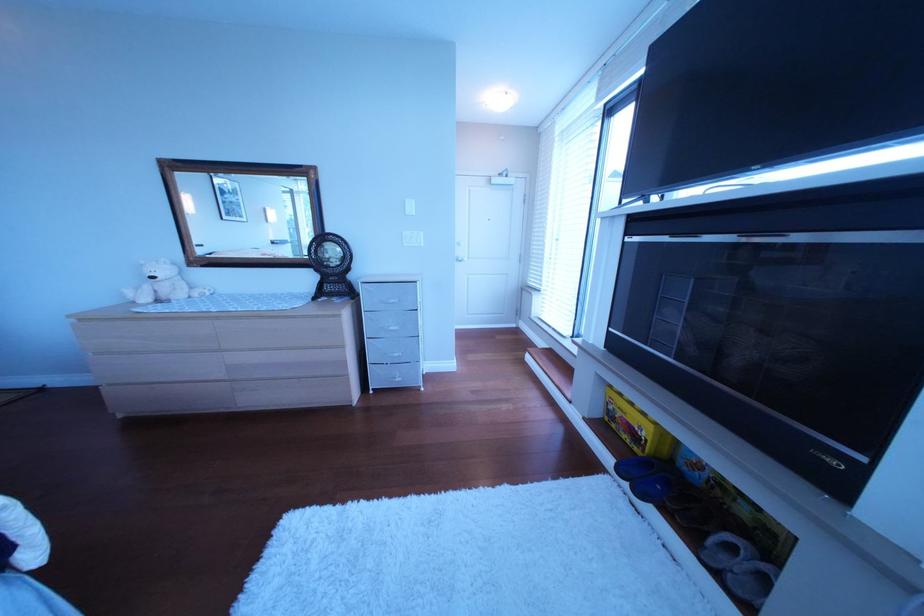
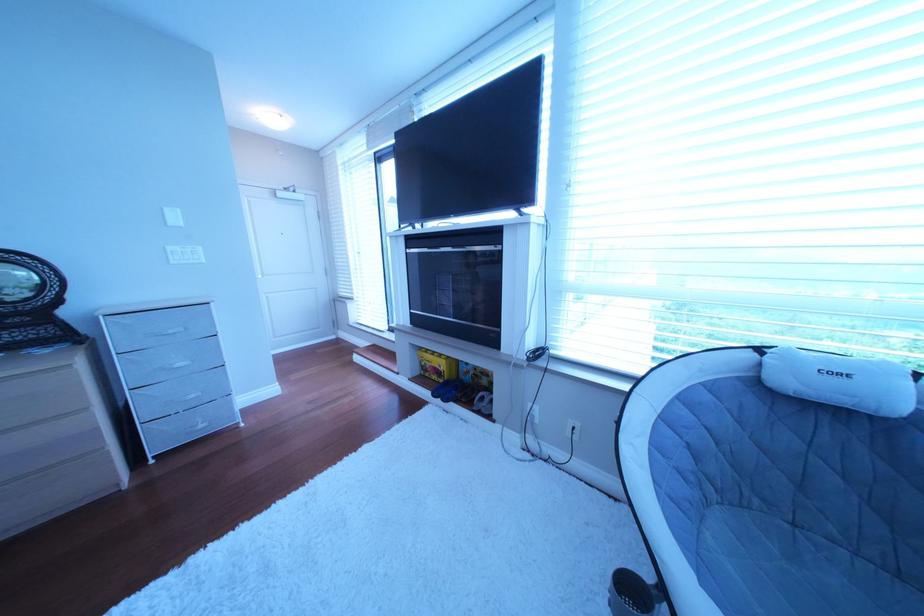
Where in the second image is the point corresponding to pixel 419 203 from the first image?

(177, 211)